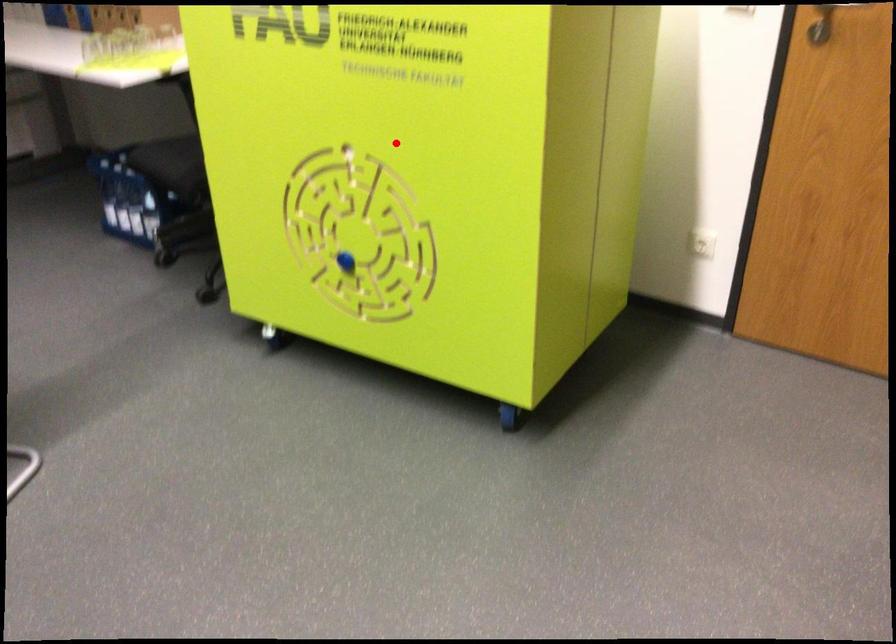
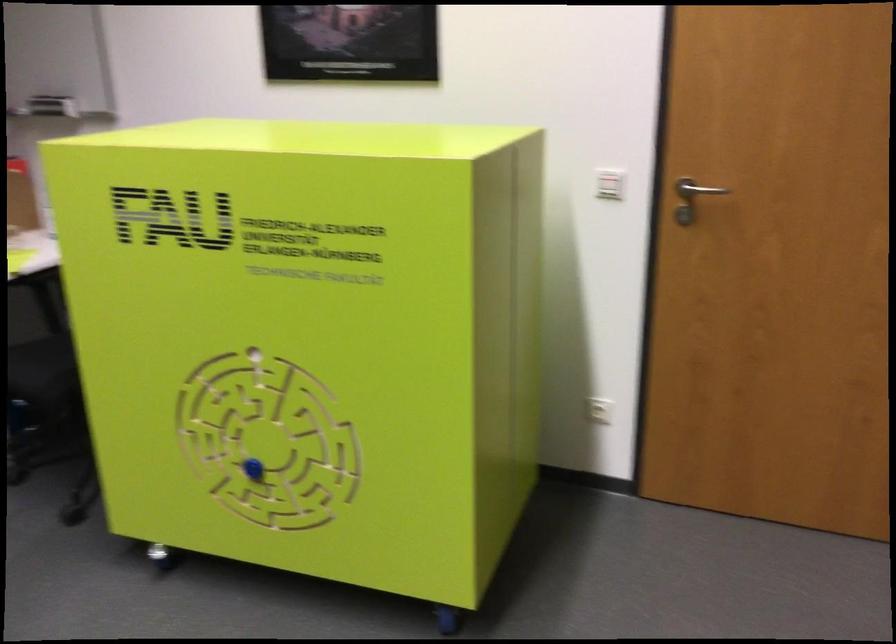
In the second image, find the point that corresponds to the highlighted location in the first image.

(309, 341)